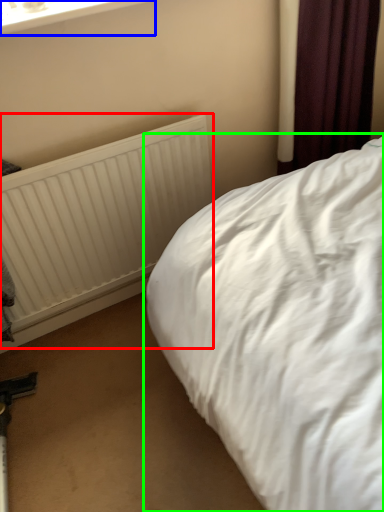
Question: Estimate the real-world distances between objects in this image. Which object is closer to radiator (highlighted by a red box), window frame (highlighted by a blue box) or bed (highlighted by a green box)?

Choices:
 (A) window frame
 (B) bed

Answer: (B)